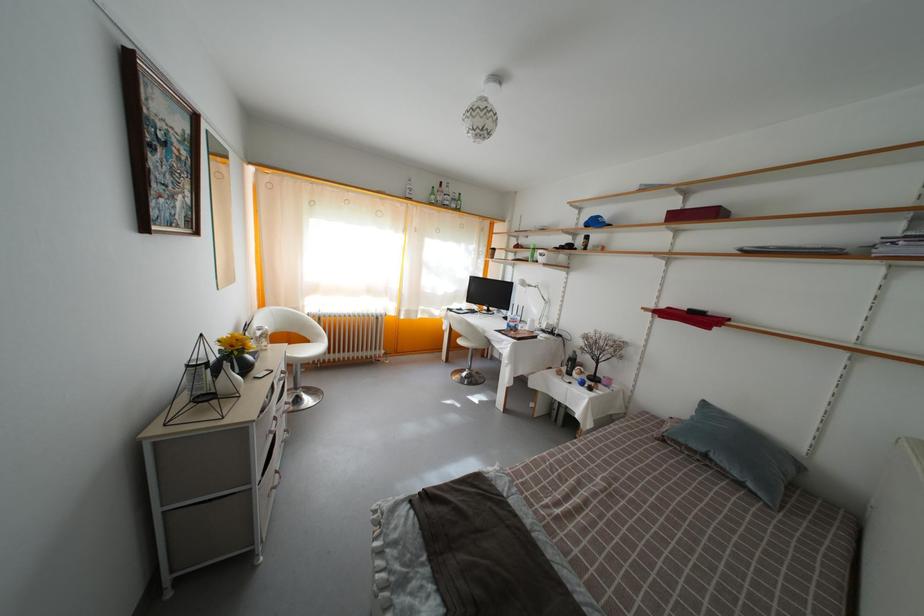
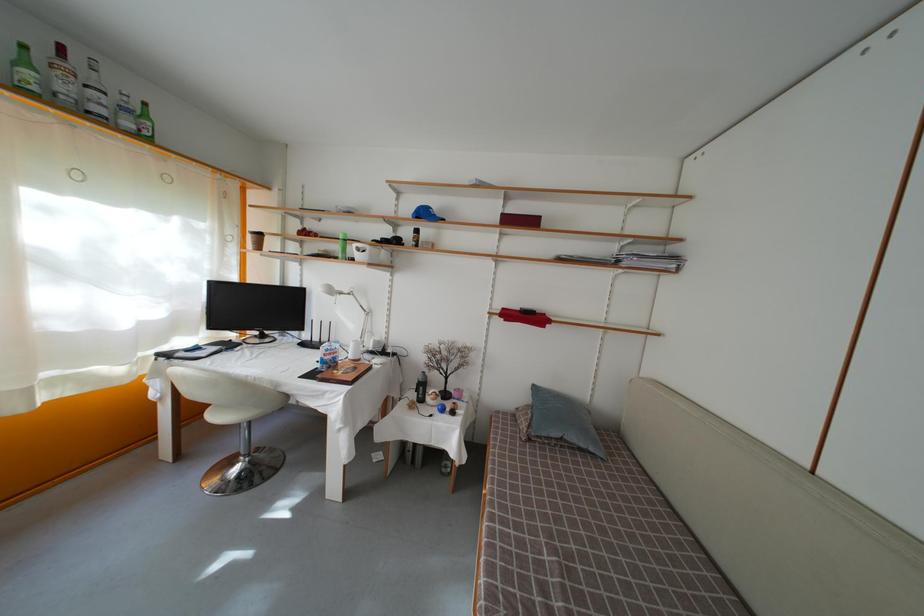
The point at (600,229) is marked in the first image. Where is the corresponding point in the second image?

(430, 220)